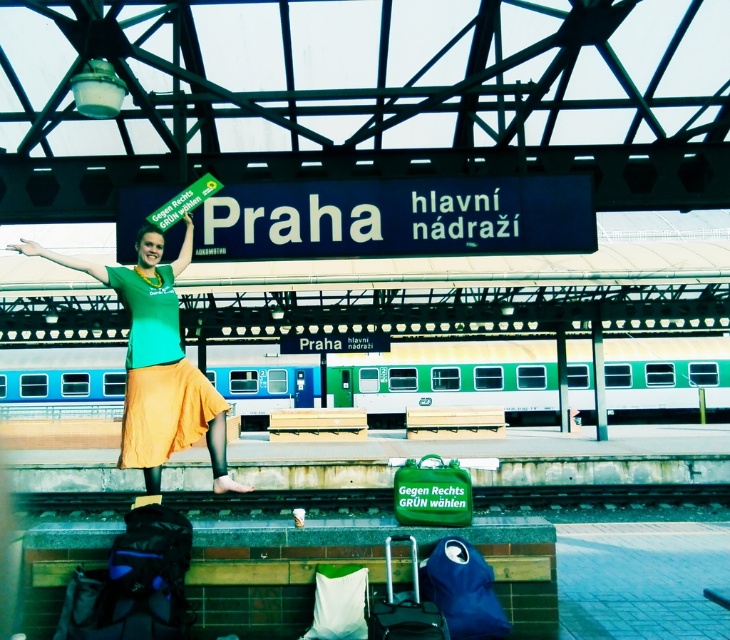
Question: Which point is closer to the camera?

Choices:
 (A) green matte t-shirt at center
 (B) green metal train track at lower center
 (C) green matte train at center
 (D) matte orange skirt at center

Answer: (A)

Question: Does green matte train at center come behind green matte t-shirt at center?

Choices:
 (A) no
 (B) yes

Answer: (B)

Question: Which object appears closest to the camera in this image?

Choices:
 (A) matte orange skirt at center
 (B) green matte t-shirt at center
 (C) green matte train at center

Answer: (B)

Question: Can you confirm if green matte t-shirt at center is wider than matte black suitcase at lower center?

Choices:
 (A) no
 (B) yes

Answer: (B)

Question: Can you confirm if green matte train at center is positioned above green metal train track at lower center?

Choices:
 (A) yes
 (B) no

Answer: (A)

Question: Which point appears farthest from the camera in this image?

Choices:
 (A) (283, 362)
 (B) (130, 280)
 (C) (268, 499)
 (D) (372, 605)

Answer: (A)